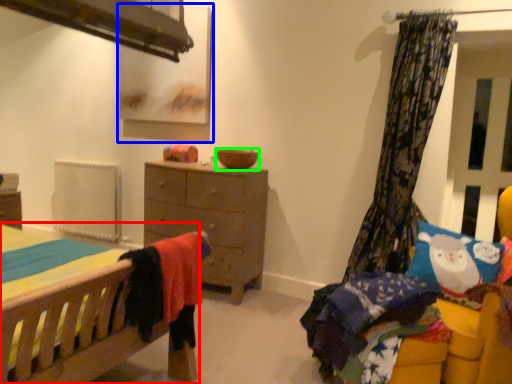
Question: Considering the real-world distances, which object is farthest from bed (highlighted by a red box)? picture frame (highlighted by a blue box) or bowl (highlighted by a green box)?

Choices:
 (A) picture frame
 (B) bowl

Answer: (A)